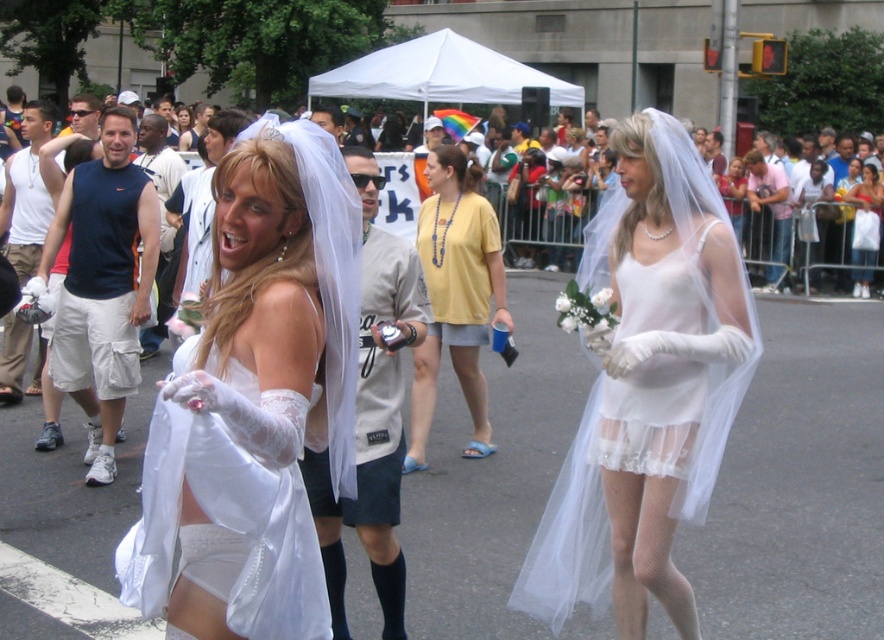
Question: Which of the following is the farthest from the observer?

Choices:
 (A) matte blue tank top at left
 (B) dark blue shirt at center

Answer: (B)

Question: Is matte white veil at center smaller than white fabric hat at center?

Choices:
 (A) yes
 (B) no

Answer: (B)

Question: Is matte white shirt at center above dark blue shirt at center?

Choices:
 (A) yes
 (B) no

Answer: (A)

Question: Is white satin dress at center positioned at the back of white fabric hat at center?

Choices:
 (A) yes
 (B) no

Answer: (B)

Question: Which is nearer to the white sheer veil at center?

Choices:
 (A) satin white veil at center
 (B) matte blue tank top at left

Answer: (B)

Question: Which point is farther from the camera taking this photo?

Choices:
 (A) (735, 182)
 (B) (836, 176)

Answer: (A)